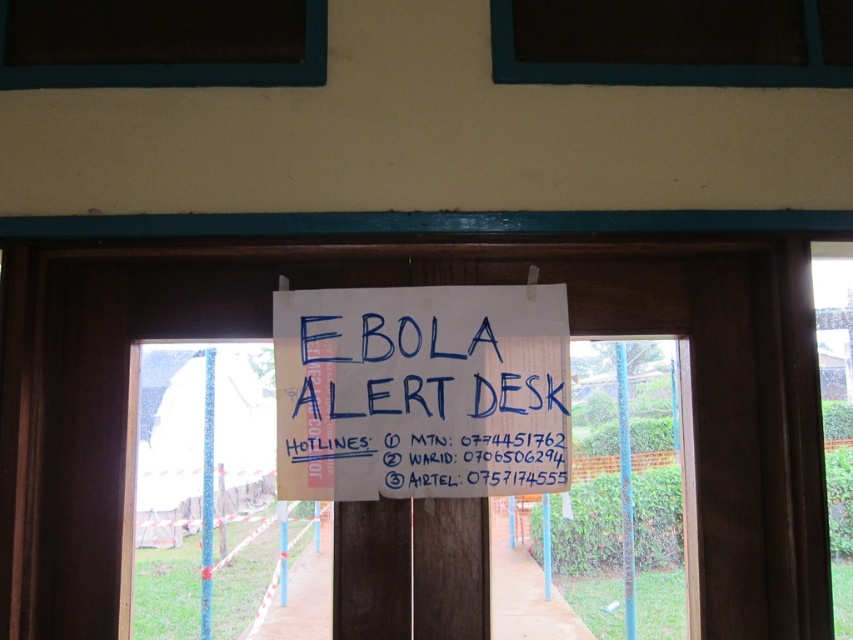
Question: Which of the following is the closest to the observer?

Choices:
 (A) blue handwritten sign at center
 (B) dark glass window at upper left

Answer: (B)

Question: Does blue handwritten sign at center appear under dark glass window at upper center?

Choices:
 (A) yes
 (B) no

Answer: (A)

Question: Is blue handwritten sign at center bigger than dark glass window at upper center?

Choices:
 (A) no
 (B) yes

Answer: (B)

Question: Which object is closer to the camera taking this photo?

Choices:
 (A) dark glass window at upper left
 (B) blue handwritten sign at center

Answer: (A)

Question: Which of these objects is positioned closest to the blue handwritten sign at center?

Choices:
 (A) dark glass window at upper left
 (B) dark glass window at upper center

Answer: (A)

Question: Does blue handwritten sign at center appear under dark glass window at upper left?

Choices:
 (A) yes
 (B) no

Answer: (A)